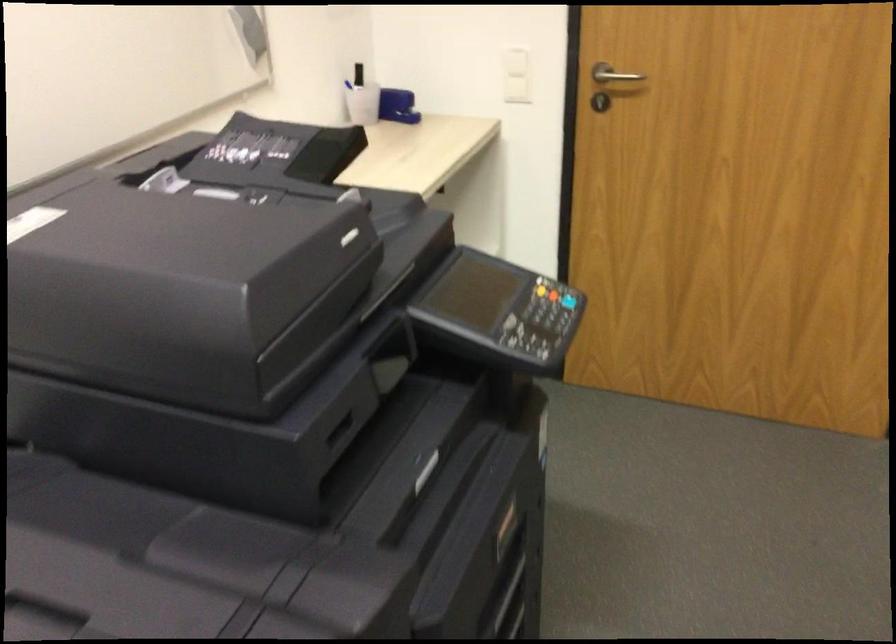
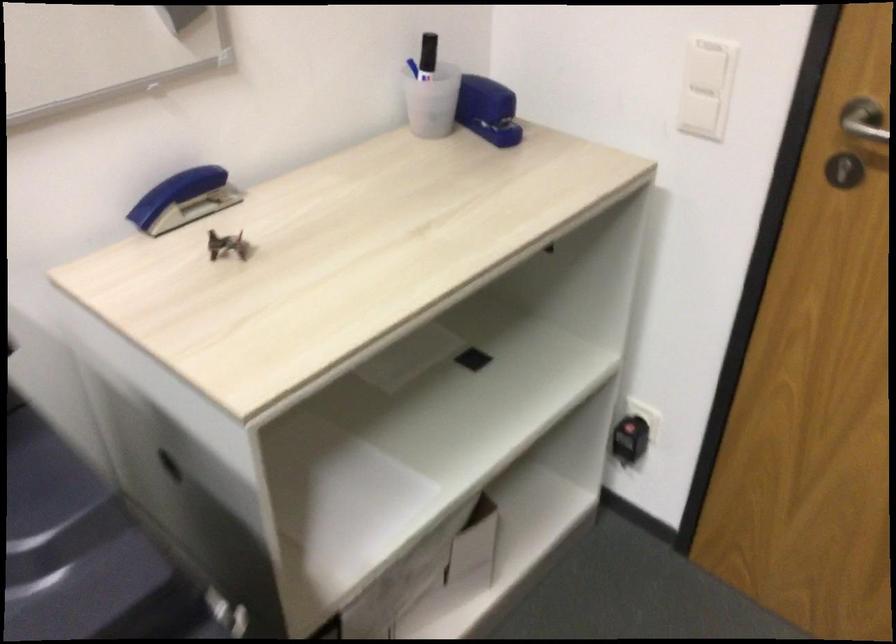
Where in the second image is the point corresponding to point (520, 80) from the first image?

(696, 99)